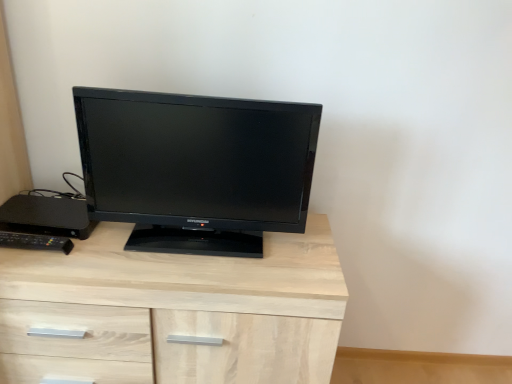
Question: Is black glossy monitor at center shorter than black plastic remote control at left, which is the first desktop from front to back?

Choices:
 (A) no
 (B) yes

Answer: (A)

Question: Can you confirm if black glossy monitor at center is thinner than black plastic remote control at left, which is counted as the 2th desktop, starting from the back?

Choices:
 (A) yes
 (B) no

Answer: (B)

Question: From the image's perspective, does black glossy monitor at center appear higher than black plastic remote control at left, which is counted as the 2th desktop, starting from the back?

Choices:
 (A) yes
 (B) no

Answer: (A)

Question: From a real-world perspective, is black glossy monitor at center positioned under black plastic remote control at left, which is counted as the 2th desktop, starting from the back, based on gravity?

Choices:
 (A) yes
 (B) no

Answer: (B)

Question: Is black glossy monitor at center positioned with its back to black plastic remote control at left, which is counted as the 2th desktop, starting from the back?

Choices:
 (A) no
 (B) yes

Answer: (A)

Question: Can you confirm if black glossy monitor at center is wider than black plastic remote control at left, which is the first desktop from front to back?

Choices:
 (A) yes
 (B) no

Answer: (A)

Question: Is black plastic desktop at left, the second desktop in the front-to-back sequence, shorter than black glossy monitor at center?

Choices:
 (A) no
 (B) yes

Answer: (B)

Question: Considering the relative sizes of black plastic desktop at left, acting as the first desktop starting from the back, and black glossy monitor at center in the image provided, is black plastic desktop at left, acting as the first desktop starting from the back, thinner than black glossy monitor at center?

Choices:
 (A) no
 (B) yes

Answer: (B)

Question: Does black plastic desktop at left, the second desktop in the front-to-back sequence, lie in front of black glossy monitor at center?

Choices:
 (A) no
 (B) yes

Answer: (A)

Question: Is black plastic desktop at left, acting as the first desktop starting from the back, next to black glossy monitor at center and touching it?

Choices:
 (A) no
 (B) yes

Answer: (A)

Question: Is black plastic desktop at left, acting as the first desktop starting from the back, to the right of black glossy monitor at center from the viewer's perspective?

Choices:
 (A) yes
 (B) no

Answer: (B)

Question: Considering the relative sizes of black plastic desktop at left, the second desktop in the front-to-back sequence, and black glossy monitor at center in the image provided, is black plastic desktop at left, the second desktop in the front-to-back sequence, smaller than black glossy monitor at center?

Choices:
 (A) no
 (B) yes

Answer: (B)

Question: Can you confirm if light wood chest of drawers at center is positioned to the right of black plastic desktop at left, the second desktop in the front-to-back sequence?

Choices:
 (A) yes
 (B) no

Answer: (A)